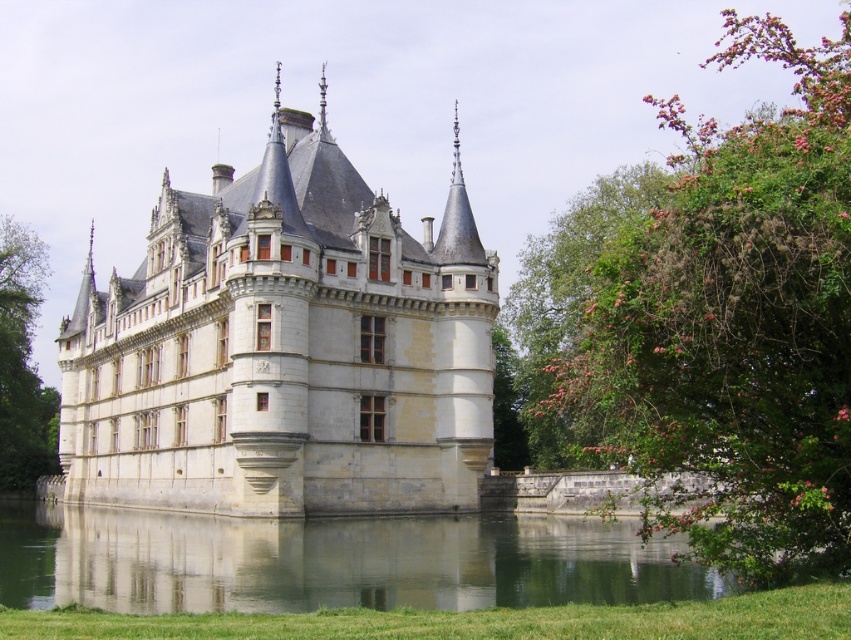
You are a gardener standing in front of the castle. You notice the green leafy bush at right and the green leafy tree at left. Which one is taller?

The green leafy bush at right is taller than the green leafy tree at left.

You are standing in front of the castle and notice the transparent water at lower center and the green leafy tree at left. Which one appears shorter in the scene?

The transparent water at lower center appears shorter than the green leafy tree at left.